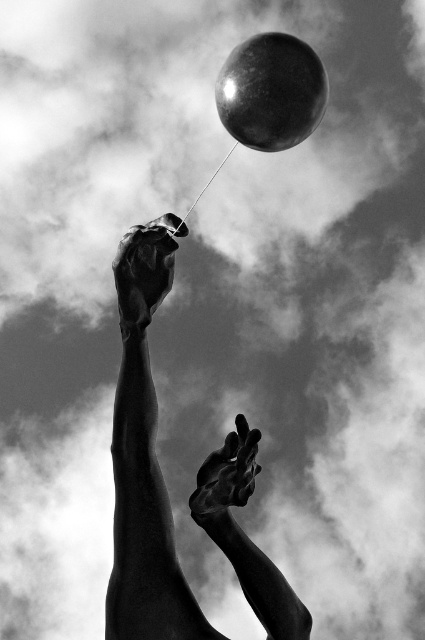
Does point (133, 522) come closer to viewer compared to point (209, 465)?

Yes, point (133, 522) is in front of point (209, 465).

Can you confirm if polished bronze statue hands at center is thinner than shiny metallic hand at center?

In fact, polished bronze statue hands at center might be wider than shiny metallic hand at center.

Which is behind, point (153, 308) or point (235, 488)?

The point (153, 308) is behind.

Identify the location of polished bronze statue hands at center. The width and height of the screenshot is (425, 640). (144, 458).

Image resolution: width=425 pixels, height=640 pixels. I want to click on glossy metallic balloon at upper center, so click(271, 92).

Is glossy metallic balloon at upper center smaller than polished bronze hand at upper center?

No.

Between point (300, 61) and point (156, 280), which one is positioned behind?

The point (300, 61) is behind.

Find the location of `glossy metallic balloon at upper center`. glossy metallic balloon at upper center is located at coordinates (271, 92).

Does polished bronze statue hands at center appear on the right side of polished bronze hand at upper center?

Indeed, polished bronze statue hands at center is positioned on the right side of polished bronze hand at upper center.

Based on the photo, can you confirm if polished bronze statue hands at center is taller than polished bronze hand at upper center?

Yes, polished bronze statue hands at center is taller than polished bronze hand at upper center.

This screenshot has height=640, width=425. Find the location of `polished bronze statue hands at center`. polished bronze statue hands at center is located at coordinates (144, 458).